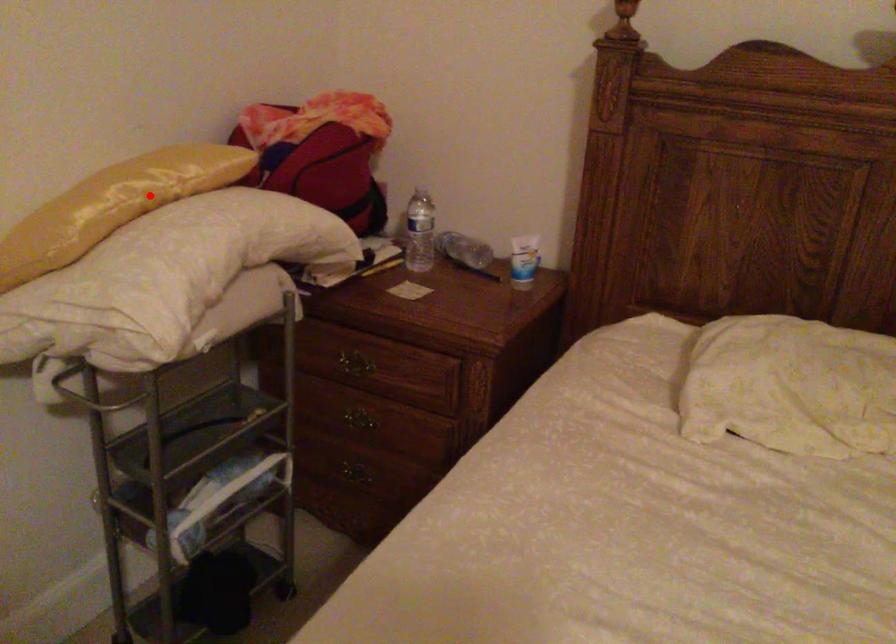
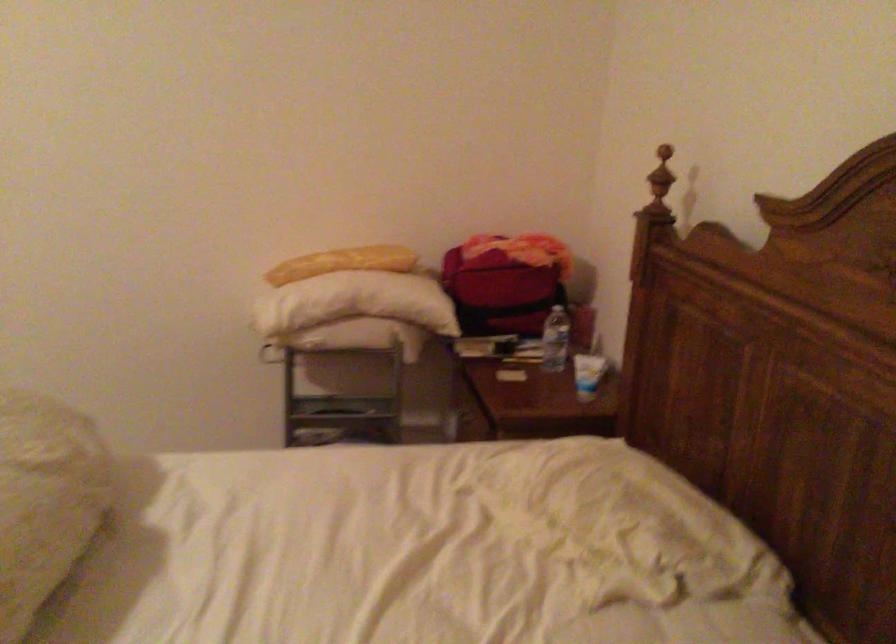
Question: I am providing you with two images of the same scene from different viewpoints. In image1, a red point is highlighted. Considering the same 3D point in image2, which of the following is correct?

Choices:
 (A) It is closer
 (B) It is farther

Answer: (B)